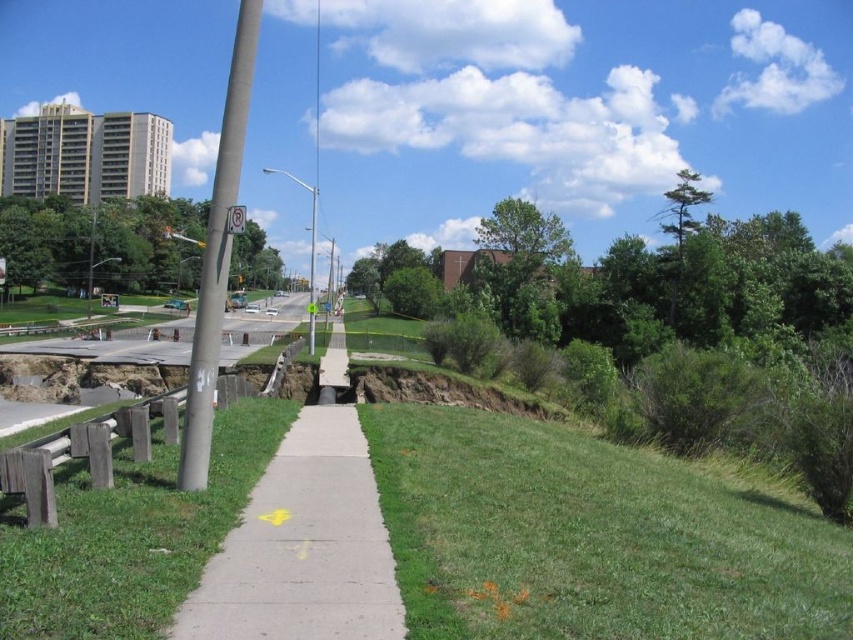
You are a gardener who needs to mow the lawn. You see the green grassy at lower right and the green grass at lower left. Which area requires more immediate attention based on their height?

The green grassy at lower right requires more immediate attention because it has a greater height compared to the green grass at lower left.

You are a gardener who needs to mow the lawn. You see the green grass at lower left and the concrete sidewalk at center. Which area requires mowing?

The green grass at lower left requires mowing because it has a greater height compared to the concrete sidewalk at center.

You are a delivery person with a cart that is 3 meters wide. You need to move from the green grassy at lower right to the green grass at lower left. Can your cart fit through the space between them?

The distance between the green grassy at lower right and green grass at lower left is 5.66 meters. Since your cart is 3 meters wide, it can easily fit through the space between them as 5.66 meters is wider than 3 meters.